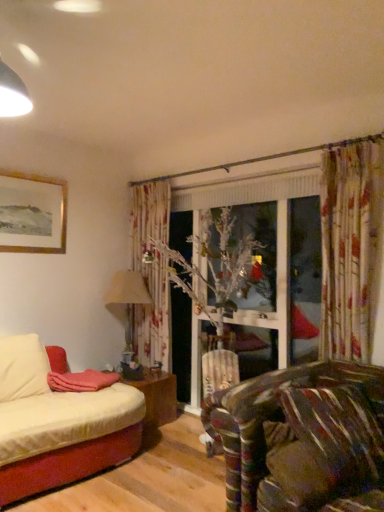
The image size is (384, 512). I want to click on brown textured pillow at lower right, acting as the first pillow starting from the left, so click(296, 468).

Locate an element on the screen. The image size is (384, 512). velvet brown pillow at lower right, marked as the first pillow in a right-to-left arrangement is located at coordinates (338, 432).

Image resolution: width=384 pixels, height=512 pixels. What do you see at coordinates (338, 432) in the screenshot? I see `velvet brown pillow at lower right, the 2th pillow positioned from the left` at bounding box center [338, 432].

Image resolution: width=384 pixels, height=512 pixels. Describe the element at coordinates (81, 381) in the screenshot. I see `pink soft blanket at lower left` at that location.

Where is `brown textured pillow at lower right, which appears as the second pillow when viewed from the right`? brown textured pillow at lower right, which appears as the second pillow when viewed from the right is located at coordinates (296, 468).

In terms of height, does brown textured pillow at lower right, acting as the first pillow starting from the left, look taller or shorter compared to velvet brown pillow at lower right, the 2th pillow positioned from the left?

In the image, brown textured pillow at lower right, acting as the first pillow starting from the left, appears to be shorter than velvet brown pillow at lower right, the 2th pillow positioned from the left.

Is brown textured pillow at lower right, acting as the first pillow starting from the left, surrounding velvet brown pillow at lower right, marked as the first pillow in a right-to-left arrangement?

No, velvet brown pillow at lower right, marked as the first pillow in a right-to-left arrangement, is not a part of brown textured pillow at lower right, acting as the first pillow starting from the left.

In the scene shown: Considering the positions of objects brown textured pillow at lower right, which appears as the second pillow when viewed from the right, and velvet brown pillow at lower right, marked as the first pillow in a right-to-left arrangement, in the image provided, who is in front, brown textured pillow at lower right, which appears as the second pillow when viewed from the right, or velvet brown pillow at lower right, marked as the first pillow in a right-to-left arrangement,?

brown textured pillow at lower right, which appears as the second pillow when viewed from the right.

Relative to gold-framed painting at upper left, is brown textured pillow at lower right, which appears as the second pillow when viewed from the right, in front or behind?

Clearly, brown textured pillow at lower right, which appears as the second pillow when viewed from the right, is in front of gold-framed painting at upper left.

Is brown textured pillow at lower right, acting as the first pillow starting from the left, taller or shorter than gold-framed painting at upper left?

Considering their sizes, brown textured pillow at lower right, acting as the first pillow starting from the left, has less height than gold-framed painting at upper left.

Is brown textured pillow at lower right, which appears as the second pillow when viewed from the right, wider or thinner than gold-framed painting at upper left?

Result: Clearly, brown textured pillow at lower right, which appears as the second pillow when viewed from the right, has more width compared to gold-framed painting at upper left.

Measure the distance between brown textured pillow at lower right, which appears as the second pillow when viewed from the right, and gold-framed painting at upper left.

brown textured pillow at lower right, which appears as the second pillow when viewed from the right, is 8.47 feet from gold-framed painting at upper left.

Based on the photo, in terms of height, does beige fabric lampshade at center look taller or shorter compared to gold-framed painting at upper left?

Clearly, beige fabric lampshade at center is taller compared to gold-framed painting at upper left.

From a real-world perspective, between beige fabric lampshade at center and gold-framed painting at upper left, who is vertically higher?

From a 3D spatial view, gold-framed painting at upper left is above.

Does beige fabric lampshade at center appear on the left side of gold-framed painting at upper left?

In fact, beige fabric lampshade at center is to the right of gold-framed painting at upper left.

Between beige fabric lampshade at center and gold-framed painting at upper left, which one has larger width?

beige fabric lampshade at center is wider.

Is pink soft blanket at lower left further to the viewer compared to velvet brown pillow at lower right, the 2th pillow positioned from the left?

Yes, pink soft blanket at lower left is further from the camera.

Considering the sizes of pink soft blanket at lower left and velvet brown pillow at lower right, the 2th pillow positioned from the left, in the image, is pink soft blanket at lower left wider or thinner than velvet brown pillow at lower right, the 2th pillow positioned from the left,?

pink soft blanket at lower left is wider than velvet brown pillow at lower right, the 2th pillow positioned from the left.

Considering the sizes of objects pink soft blanket at lower left and velvet brown pillow at lower right, the 2th pillow positioned from the left, in the image provided, who is shorter, pink soft blanket at lower left or velvet brown pillow at lower right, the 2th pillow positioned from the left,?

Standing shorter between the two is pink soft blanket at lower left.

Which object is further away from the camera, beige fabric lampshade at center or brown textured pillow at lower right, which appears as the second pillow when viewed from the right?

beige fabric lampshade at center.

From the image's perspective, between beige fabric lampshade at center and brown textured pillow at lower right, acting as the first pillow starting from the left, who is located below?

brown textured pillow at lower right, acting as the first pillow starting from the left.

This screenshot has width=384, height=512. In order to click on lamp located behind the brown textured pillow at lower right, acting as the first pillow starting from the left in this screenshot , I will do `click(127, 298)`.

Who is taller, beige fabric lampshade at center or wooden table at lower left?

beige fabric lampshade at center.

Is beige fabric lampshade at center directly adjacent to wooden table at lower left?

No, beige fabric lampshade at center is not in contact with wooden table at lower left.

Is point (120, 282) positioned in front of point (172, 388)?

Yes, it is in front of point (172, 388).

Is pink soft blanket at lower left positioned far away from beige fabric lampshade at center?

No, pink soft blanket at lower left is not far from beige fabric lampshade at center.

From a real-world perspective, which object rests below the other?

In real-world perspective, pink soft blanket at lower left is lower.

Based on their positions, is pink soft blanket at lower left located to the left or right of beige fabric lampshade at center?

From the image, it's evident that pink soft blanket at lower left is to the left of beige fabric lampshade at center.

In the image, there is a velvet brown pillow at lower right, the 2th pillow positioned from the left. Identify the location of pillow below it (from a real-world perspective). (296, 468).

Which pillow is the 2nd one when counting from the front of the gold-framed painting at upper left? Please provide its 2D coordinates.

[(296, 468)]

Based on their spatial positions, is gold-framed painting at upper left or velvet brown pillow at lower right, marked as the first pillow in a right-to-left arrangement, closer to beige fabric lampshade at center?

gold-framed painting at upper left lies closer to beige fabric lampshade at center than the other object.

From the image, which object appears to be farther from wooden table at lower left, beige fabric lampshade at center or pink soft blanket at lower left?

The object further to wooden table at lower left is beige fabric lampshade at center.

Which object lies nearer to the anchor point pink soft blanket at lower left, brown textured pillow at lower right, which appears as the second pillow when viewed from the right, or wooden table at lower left?

Among the two, wooden table at lower left is located nearer to pink soft blanket at lower left.

From the image, which object appears to be farther from velvet brown pillow at lower right, the 2th pillow positioned from the left, wooden table at lower left or gold-framed painting at upper left?

gold-framed painting at upper left lies further to velvet brown pillow at lower right, the 2th pillow positioned from the left, than the other object.

Which object lies nearer to the anchor point brown textured pillow at lower right, acting as the first pillow starting from the left, pink soft blanket at lower left or beige fabric lampshade at center?

pink soft blanket at lower left lies closer to brown textured pillow at lower right, acting as the first pillow starting from the left, than the other object.

Looking at the image, which one is located closer to pink soft blanket at lower left, velvet brown pillow at lower right, the 2th pillow positioned from the left, or brown textured pillow at lower right, which appears as the second pillow when viewed from the right?

The object closer to pink soft blanket at lower left is brown textured pillow at lower right, which appears as the second pillow when viewed from the right.

Which object lies further to the anchor point gold-framed painting at upper left, beige fabric lampshade at center or brown textured pillow at lower right, acting as the first pillow starting from the left?

brown textured pillow at lower right, acting as the first pillow starting from the left.

Looking at the image, which one is located further to wooden table at lower left, brown textured pillow at lower right, acting as the first pillow starting from the left, or pink soft blanket at lower left?

Among the two, brown textured pillow at lower right, acting as the first pillow starting from the left, is located further to wooden table at lower left.

Identify the location of lamp between gold-framed painting at upper left and pink soft blanket at lower left vertically. (127, 298).

You are a GUI agent. You are given a task and a screenshot of the screen. Output one action in this format:
    pyautogui.click(x=<x>, y=<y>)
    Task: Click on the blanket between velvet brown pillow at lower right, marked as the first pillow in a right-to-left arrangement, and beige fabric lampshade at center, along the z-axis
    
    Given the screenshot: What is the action you would take?
    [x=81, y=381]

At what (x,y) coordinates should I click in order to perform the action: click on blanket between beige fabric lampshade at center and wooden table at lower left in the vertical direction. Please return your answer as a coordinate pair (x, y). This screenshot has width=384, height=512. Looking at the image, I should click on (81, 381).

I want to click on picture frame located between brown textured pillow at lower right, which appears as the second pillow when viewed from the right, and beige fabric lampshade at center in the depth direction, so click(x=32, y=213).